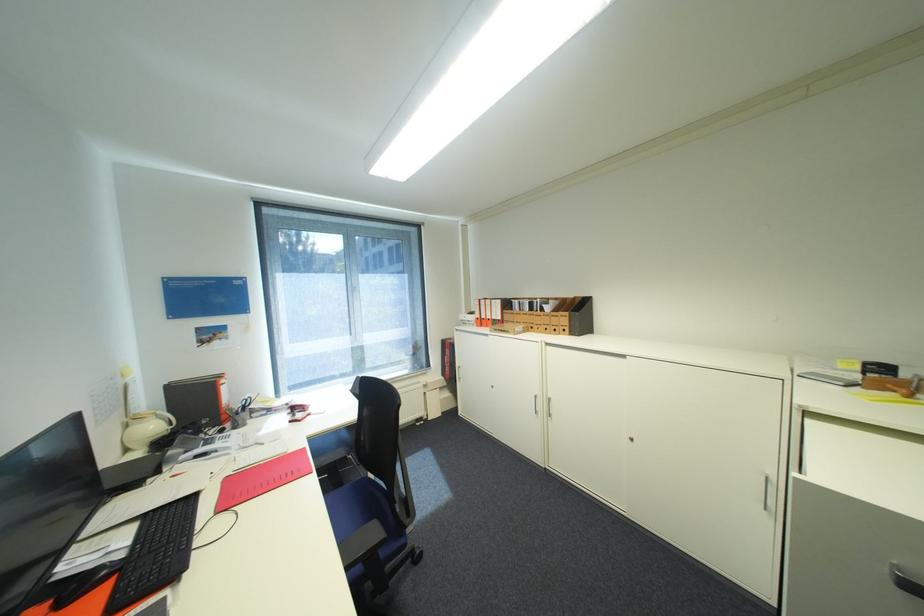
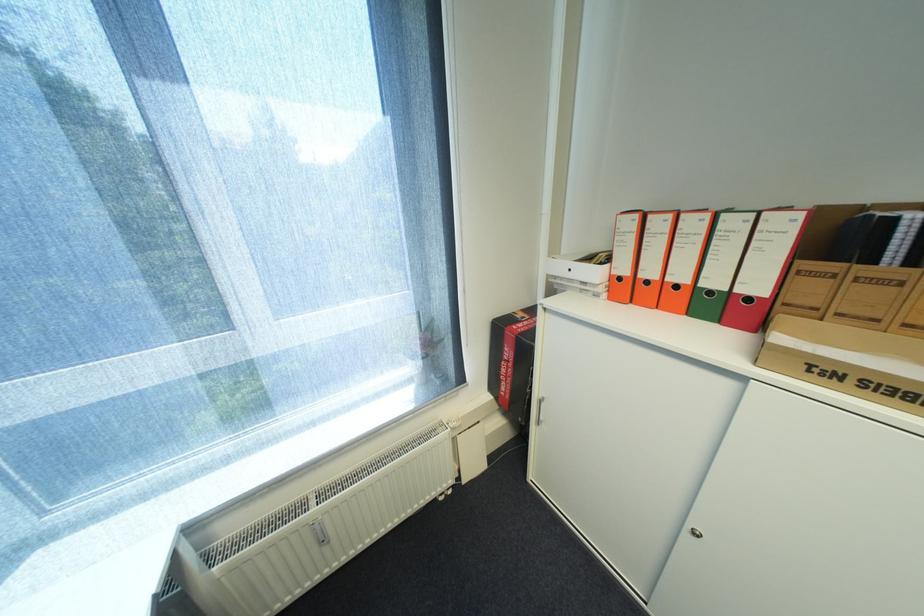
The point at (485, 318) is marked in the first image. Where is the corresponding point in the second image?

(627, 278)